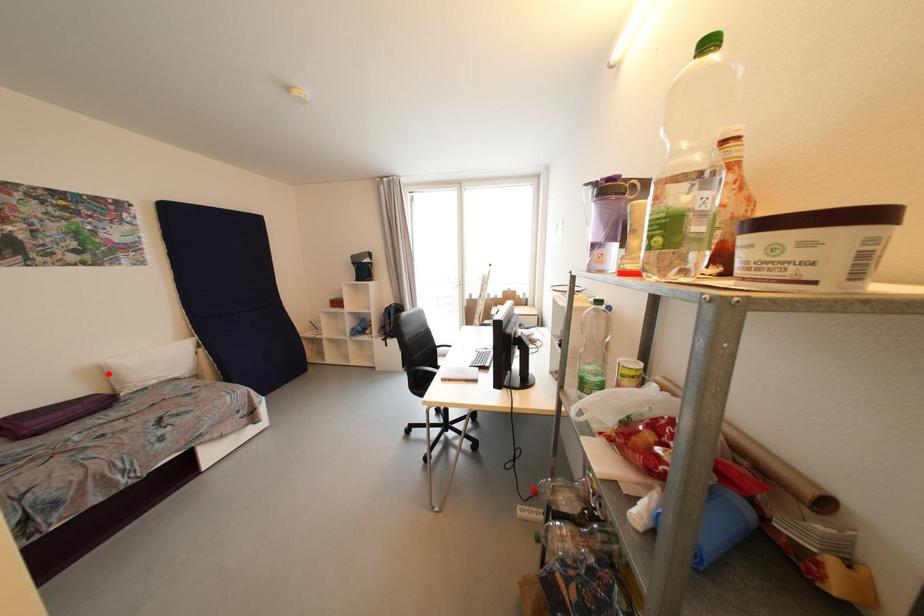
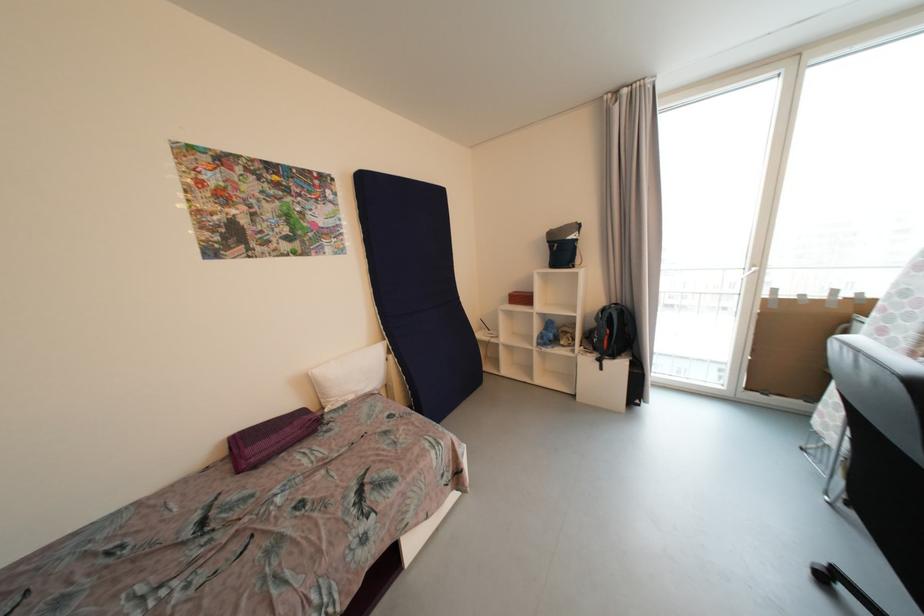
Question: I am providing you with two images of the same scene from different viewpoints. A red point is marked on the first image. Is the red point's position out of view in image 2?

Choices:
 (A) Yes
 (B) No

Answer: (B)